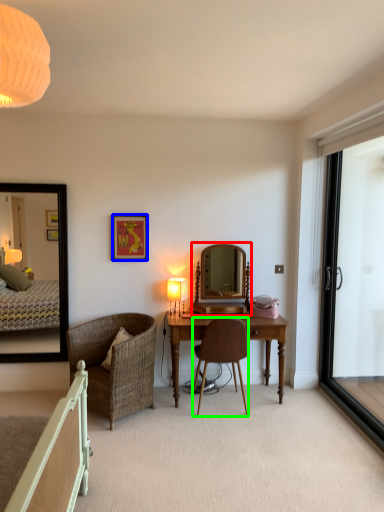
Question: Which object is positioned closest to mirror (highlighted by a red box)? Select from picture frame (highlighted by a blue box) and chair (highlighted by a green box).

Choices:
 (A) picture frame
 (B) chair

Answer: (B)